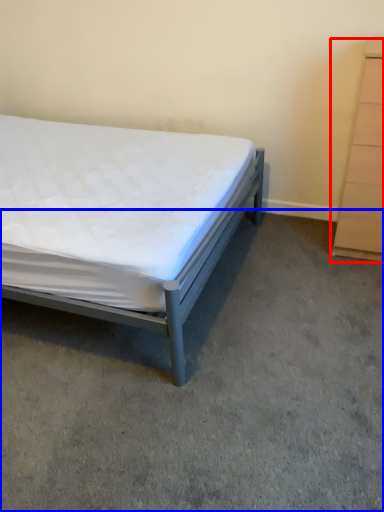
Question: Which object is closer to the camera taking this photo, chest of drawers (highlighted by a red box) or concrete (highlighted by a blue box)?

Choices:
 (A) chest of drawers
 (B) concrete

Answer: (B)